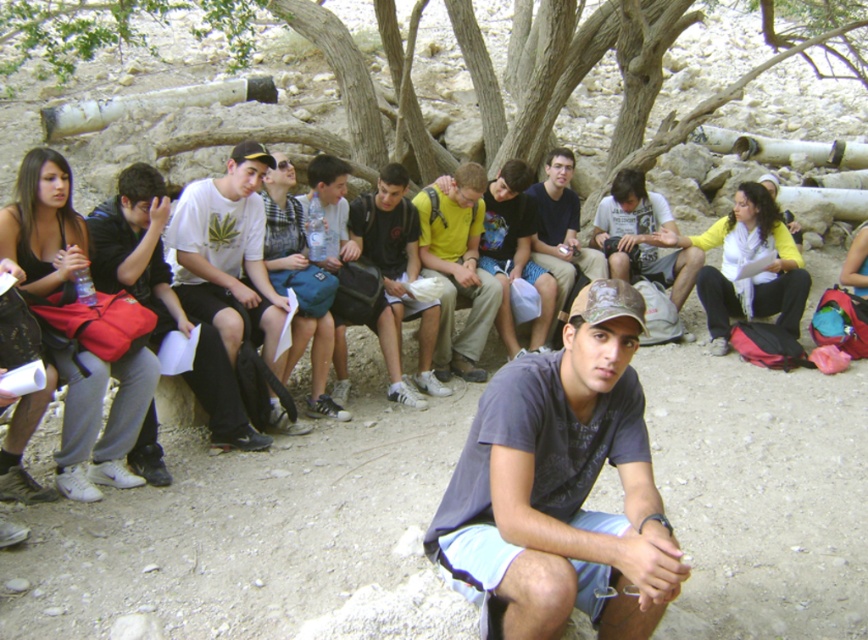
This screenshot has height=640, width=868. I want to click on dark gray t-shirt at center, so click(562, 484).

You are a GUI agent. You are given a task and a screenshot of the screen. Output one action in this format:
    pyautogui.click(x=<x>, y=<y>)
    Task: Click on the dark gray t-shirt at center
    The image size is (868, 640).
    Given the screenshot: What is the action you would take?
    pyautogui.click(x=562, y=484)

Who is taller, brown rough tree at upper center or yellow matte shirt at center?

With more height is brown rough tree at upper center.

Identify the location of brown rough tree at upper center. (630, 67).

Is point (783, 36) farther from camera compared to point (442, 225)?

Yes, it is.

Locate an element on the screen. The width and height of the screenshot is (868, 640). brown rough tree at upper center is located at coordinates (630, 67).

Who is lower down, white matte t-shirt at center or matte black backpack at center?

white matte t-shirt at center is below.

Consider the image. Can you confirm if white matte t-shirt at center is positioned to the left of matte black backpack at center?

Correct, you'll find white matte t-shirt at center to the left of matte black backpack at center.

What do you see at coordinates (227, 253) in the screenshot? The image size is (868, 640). I see `white matte t-shirt at center` at bounding box center [227, 253].

Locate an element on the screen. white matte t-shirt at center is located at coordinates (227, 253).